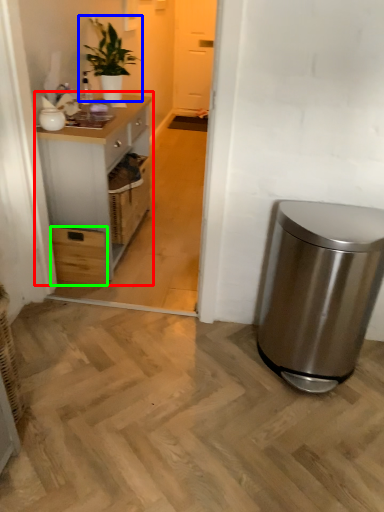
Question: Which is nearer to the cabinetry (highlighted by a red box)? houseplant (highlighted by a blue box) or drawer (highlighted by a green box).

Choices:
 (A) houseplant
 (B) drawer

Answer: (B)